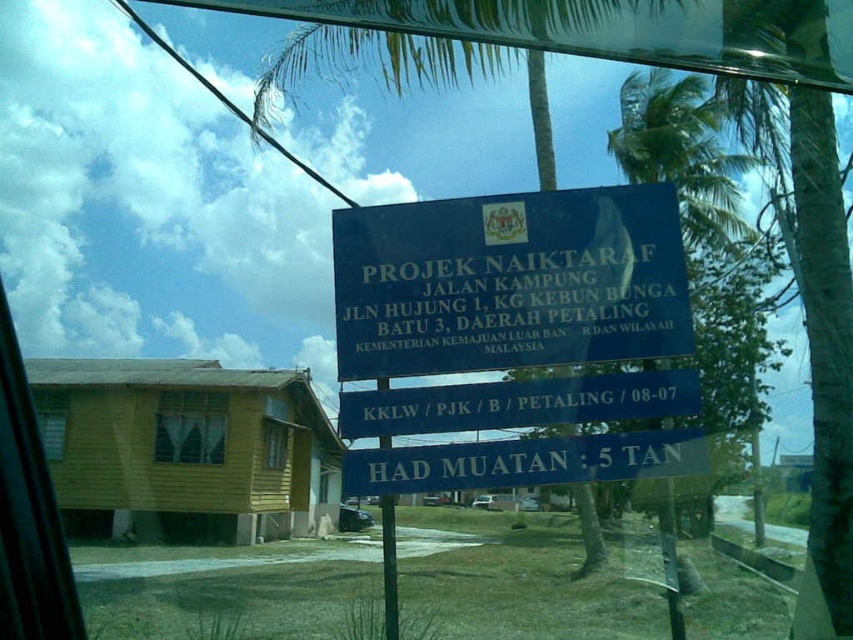
Question: Is blue metallic sign at center smaller than blue plastic signboard at center?

Choices:
 (A) yes
 (B) no

Answer: (B)

Question: Does blue plastic signboard at center appear on the right side of green painted wood pole at center?

Choices:
 (A) no
 (B) yes

Answer: (B)

Question: Among these objects, which one is farthest from the camera?

Choices:
 (A) green painted wood pole at center
 (B) blue plastic signboard at center
 (C) blue metallic sign at center
 (D) blue plastic sign at center

Answer: (C)

Question: Which of the following is the farthest from the observer?

Choices:
 (A) green painted wood pole at center
 (B) blue metallic sign at center
 (C) blue plastic sign at center

Answer: (B)

Question: Considering the real-world distances, which object is farthest from the blue plastic sign at center?

Choices:
 (A) blue plastic signboard at center
 (B) green painted wood pole at center
 (C) blue metallic sign at center

Answer: (B)

Question: Can you confirm if blue plastic sign at center is positioned to the left of green painted wood pole at center?

Choices:
 (A) no
 (B) yes

Answer: (A)